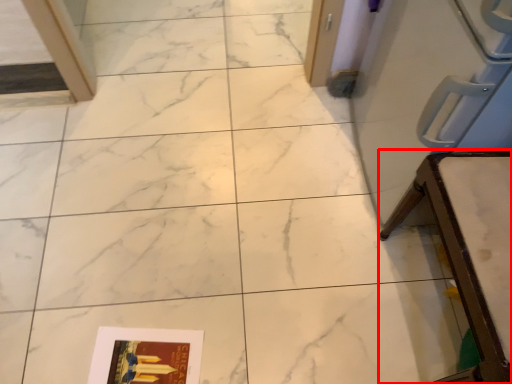
Question: From the image's perspective, where is furniture (annotated by the red box) located relative to magazine?

Choices:
 (A) below
 (B) above

Answer: (B)